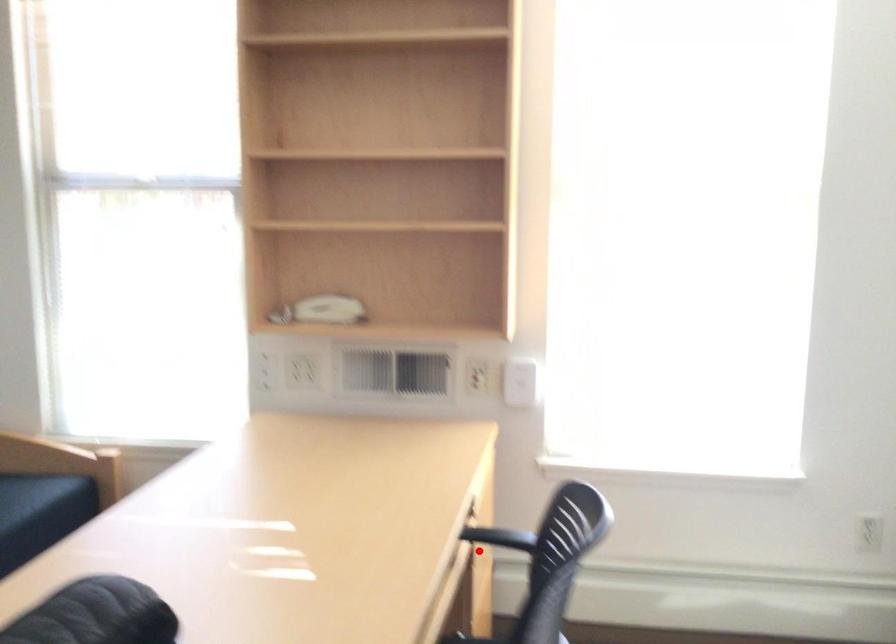
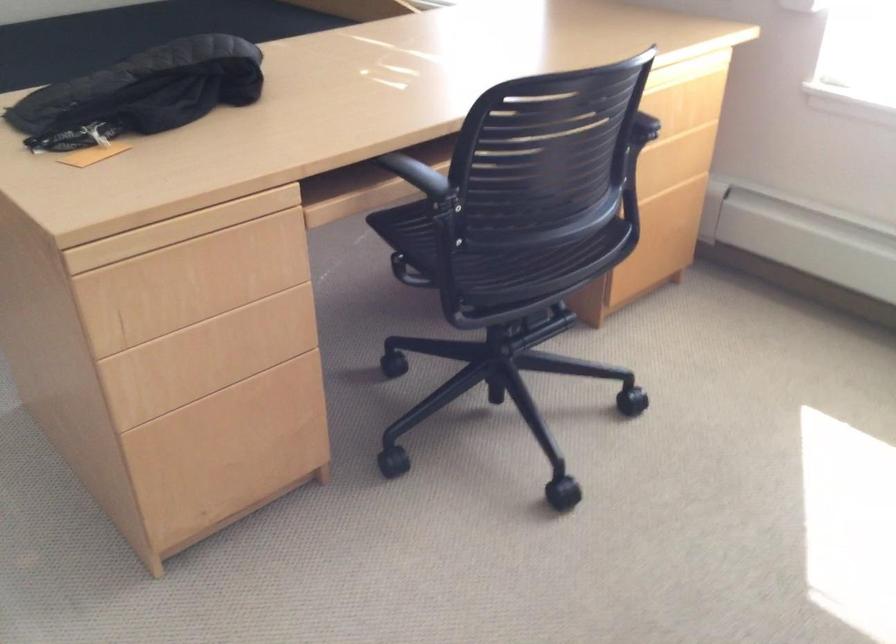
Where in the second image is the point corresponding to the highlighted location from the first image?

(640, 143)